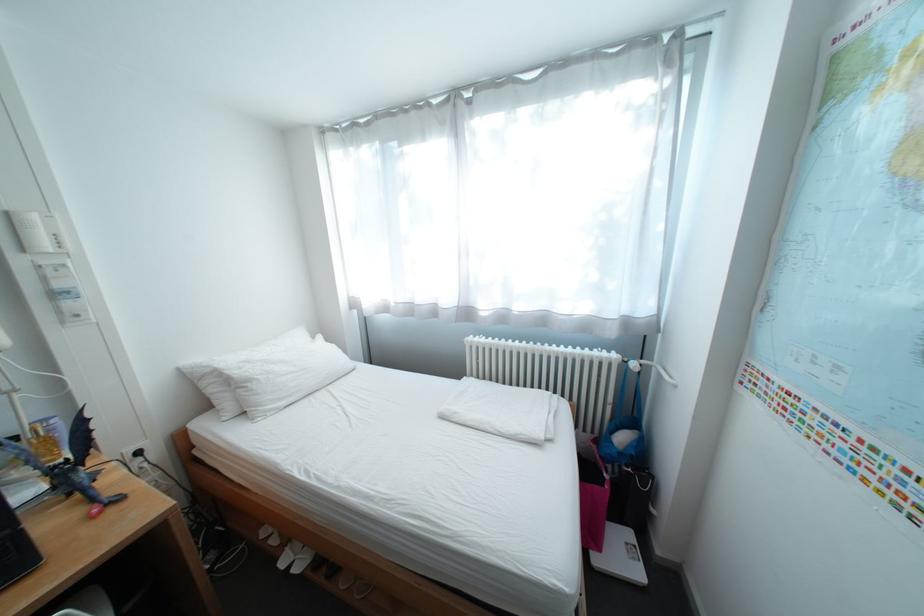
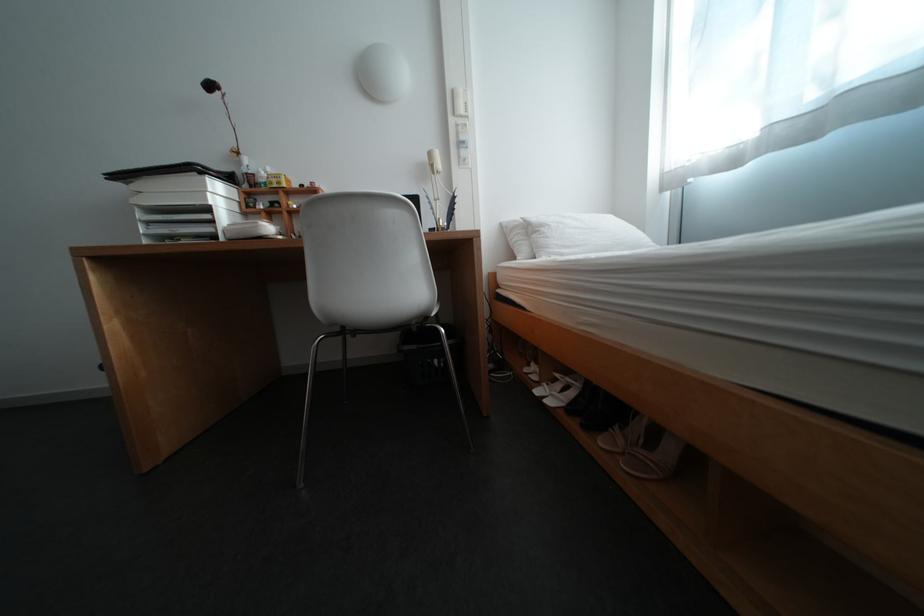
Where in the second image is the point corresponding to pixel 322 562 from the first image?

(576, 406)